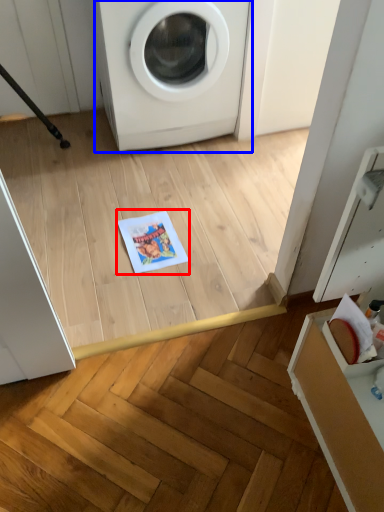
Question: Which object is further to the camera taking this photo, copy (highlighted by a red box) or washing machine (highlighted by a blue box)?

Choices:
 (A) copy
 (B) washing machine

Answer: (A)